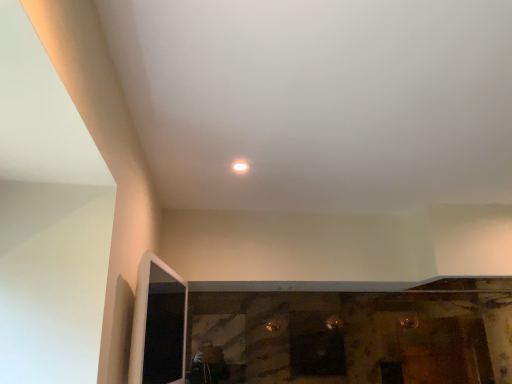
Question: Should I look upward or downward to see white glossy light at center?

Choices:
 (A) up
 (B) down

Answer: (A)

Question: Should I look upward or downward to see transparent glass screen door at lower left?

Choices:
 (A) down
 (B) up

Answer: (A)

Question: From a real-world perspective, is white glossy light at center on top of transparent glass screen door at lower left?

Choices:
 (A) yes
 (B) no

Answer: (A)

Question: Would you say white glossy light at center is outside transparent glass screen door at lower left?

Choices:
 (A) no
 (B) yes

Answer: (B)

Question: Could you tell me if white glossy light at center is facing transparent glass screen door at lower left?

Choices:
 (A) no
 (B) yes

Answer: (A)

Question: Is white glossy light at center in front of transparent glass screen door at lower left?

Choices:
 (A) no
 (B) yes

Answer: (A)

Question: Is white glossy light at center bigger than transparent glass screen door at lower left?

Choices:
 (A) no
 (B) yes

Answer: (A)

Question: Is white glossy light at center thinner than transparent glass screen door at lower left?

Choices:
 (A) yes
 (B) no

Answer: (B)

Question: From a real-world perspective, is transparent glass screen door at lower left located higher than white glossy light at center?

Choices:
 (A) no
 (B) yes

Answer: (A)

Question: Can you confirm if transparent glass screen door at lower left is smaller than white glossy light at center?

Choices:
 (A) yes
 (B) no

Answer: (B)

Question: From a real-world perspective, is transparent glass screen door at lower left positioned under white glossy light at center based on gravity?

Choices:
 (A) no
 (B) yes

Answer: (B)

Question: Can you confirm if transparent glass screen door at lower left is taller than white glossy light at center?

Choices:
 (A) yes
 (B) no

Answer: (A)

Question: Does transparent glass screen door at lower left appear on the left side of white glossy light at center?

Choices:
 (A) no
 (B) yes

Answer: (B)

Question: Is transparent glass screen door at lower left shorter than white glossy light at center?

Choices:
 (A) yes
 (B) no

Answer: (B)

Question: In the image, is transparent glass screen door at lower left on the left side or the right side of white glossy light at center?

Choices:
 (A) left
 (B) right

Answer: (A)